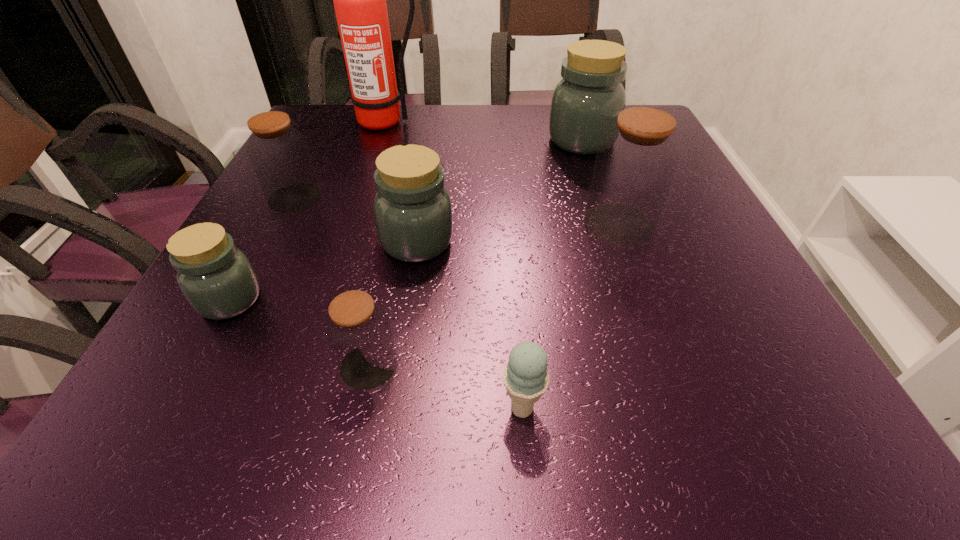
Image resolution: width=960 pixels, height=540 pixels. In order to click on unoccupied position between the rightmost brown jar and the fire extinguisher in this screenshot , I will do `click(502, 173)`.

You are a GUI agent. You are given a task and a screenshot of the screen. Output one action in this format:
    pyautogui.click(x=<x>, y=<y>)
    Task: Click on the free area in between the smallest brown jar and the second biggest green jar
    
    Given the screenshot: What is the action you would take?
    pyautogui.click(x=393, y=303)

Find the location of a particular element. object that is the seventh nearest to the smallest brown jar is located at coordinates pyautogui.click(x=359, y=0).

You are a GUI agent. You are given a task and a screenshot of the screen. Output one action in this format:
    pyautogui.click(x=<x>, y=<y>)
    Task: Click on the object that ranks as the third closest to the smallest green jar
    
    Given the screenshot: What is the action you would take?
    pyautogui.click(x=279, y=154)

At what (x,y) coordinates should I click in order to perform the action: click on the second closest jar to the sixth farthest object. Please return your answer as a coordinate pair (x, y). Looking at the image, I should click on (412, 209).

Identify the location of jar that stands as the second closest to the nearest jar. The image size is (960, 540). (412, 209).

Locate which brown jar is the second closest to the biggest brown jar. Please provide its 2D coordinates. Your answer should be formatted as a tuple, i.e. [(x, y)], where the tuple contains the x and y coordinates of a point satisfying the conditions above.

[(279, 154)]

Identify which brown jar is the second nearest to the second biggest green jar. Please provide its 2D coordinates. Your answer should be formatted as a tuple, i.e. [(x, y)], where the tuple contains the x and y coordinates of a point satisfying the conditions above.

[(358, 331)]

Point out which green jar is positioned as the second nearest to the tallest object. Please provide its 2D coordinates. Your answer should be formatted as a tuple, i.e. [(x, y)], where the tuple contains the x and y coordinates of a point satisfying the conditions above.

[(412, 209)]

Locate an element on the screen. green jar that is the third closest to the leftmost brown jar is located at coordinates (590, 95).